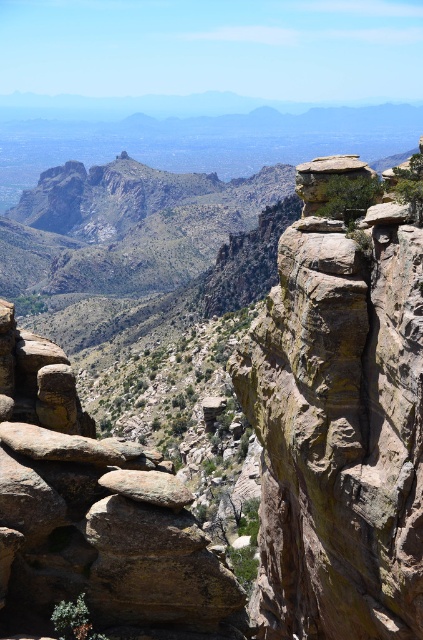
Is rusty brown rock at upper center wider than rusty rock formation at center?

In fact, rusty brown rock at upper center might be narrower than rusty rock formation at center.

Can you confirm if rusty brown rock at upper center is bigger than rusty rock formation at center?

No, rusty brown rock at upper center is not bigger than rusty rock formation at center.

Is point (266, 525) farther from camera compared to point (16, 579)?

Yes, point (266, 525) is farther from viewer.

You are a GUI agent. You are given a task and a screenshot of the screen. Output one action in this format:
    pyautogui.click(x=<x>, y=<y>)
    Task: Click on the rusty brown rock at upper center
    Image resolution: width=423 pixels, height=640 pixels.
    Given the screenshot: What is the action you would take?
    pyautogui.click(x=338, y=420)